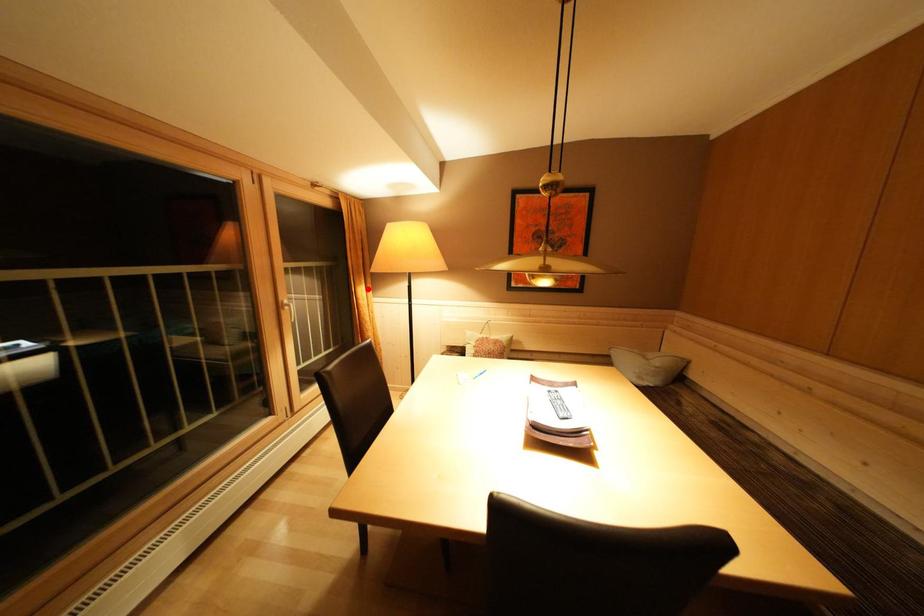
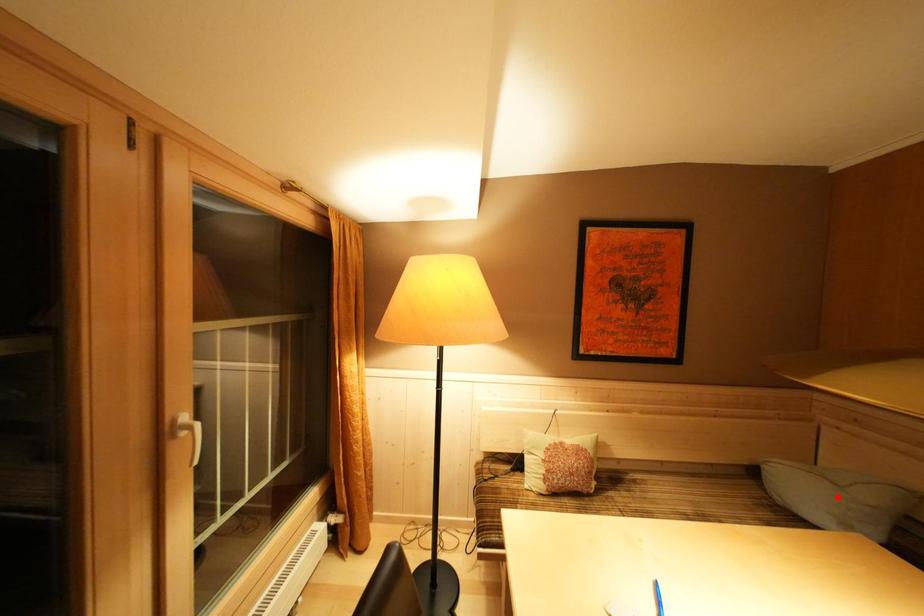
I am providing you with two images of the same scene from different viewpoints. A red point is marked on the first image and another point is marked on the second image. Are the points marked in image1 and image2 representing the same 3D position?

No